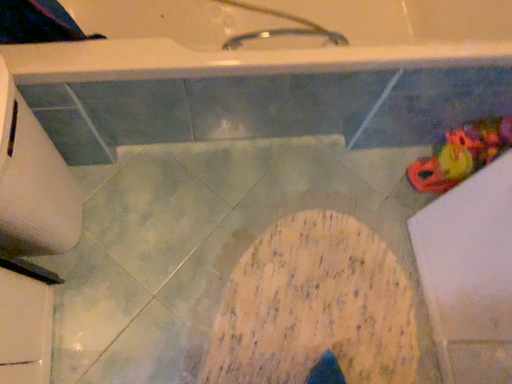
Question: Is white matte toilet paper at left thinner than rubber duck at right?

Choices:
 (A) no
 (B) yes

Answer: (A)

Question: Does white matte toilet paper at left come in front of rubber duck at right?

Choices:
 (A) yes
 (B) no

Answer: (A)

Question: From a real-world perspective, is white matte toilet paper at left under rubber duck at right?

Choices:
 (A) no
 (B) yes

Answer: (A)

Question: Is white matte toilet paper at left facing towards rubber duck at right?

Choices:
 (A) no
 (B) yes

Answer: (B)

Question: Is the position of white matte toilet paper at left more distant than that of rubber duck at right?

Choices:
 (A) yes
 (B) no

Answer: (B)

Question: From a real-world perspective, is white matte toilet paper at left over rubber duck at right?

Choices:
 (A) yes
 (B) no

Answer: (A)

Question: Is the position of rubber duck at right less distant than that of white matte toilet paper at left?

Choices:
 (A) yes
 (B) no

Answer: (B)

Question: From a real-world perspective, is rubber duck at right over white matte toilet paper at left?

Choices:
 (A) no
 (B) yes

Answer: (A)

Question: Considering the relative sizes of rubber duck at right and white matte toilet paper at left in the image provided, is rubber duck at right shorter than white matte toilet paper at left?

Choices:
 (A) yes
 (B) no

Answer: (A)

Question: From the image's perspective, is rubber duck at right located above white matte toilet paper at left?

Choices:
 (A) no
 (B) yes

Answer: (B)

Question: Does rubber duck at right have a larger size compared to white matte toilet paper at left?

Choices:
 (A) no
 (B) yes

Answer: (A)

Question: From a real-world perspective, is rubber duck at right positioned under white matte toilet paper at left based on gravity?

Choices:
 (A) no
 (B) yes

Answer: (B)

Question: From a real-world perspective, is white matte toilet paper at left positioned above or below rubber duck at right?

Choices:
 (A) above
 (B) below

Answer: (A)